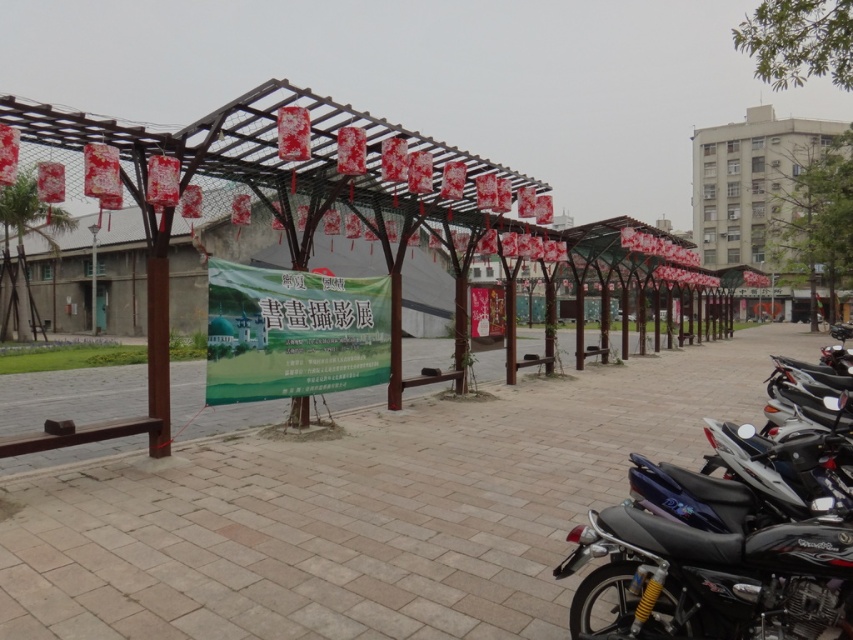
Which of these two, black glossy motorcycle at right or shiny black motorcycle at lower right, stands taller?

With more height is black glossy motorcycle at right.

Looking at this image, between black glossy motorcycle at right and shiny black motorcycle at lower right, which one appears on the right side from the viewer's perspective?

black glossy motorcycle at right is more to the right.

Between point (676, 628) and point (614, 534), which one is positioned in front?

Point (676, 628) is more forward.

Where is `black glossy motorcycle at right`? black glossy motorcycle at right is located at coordinates (706, 579).